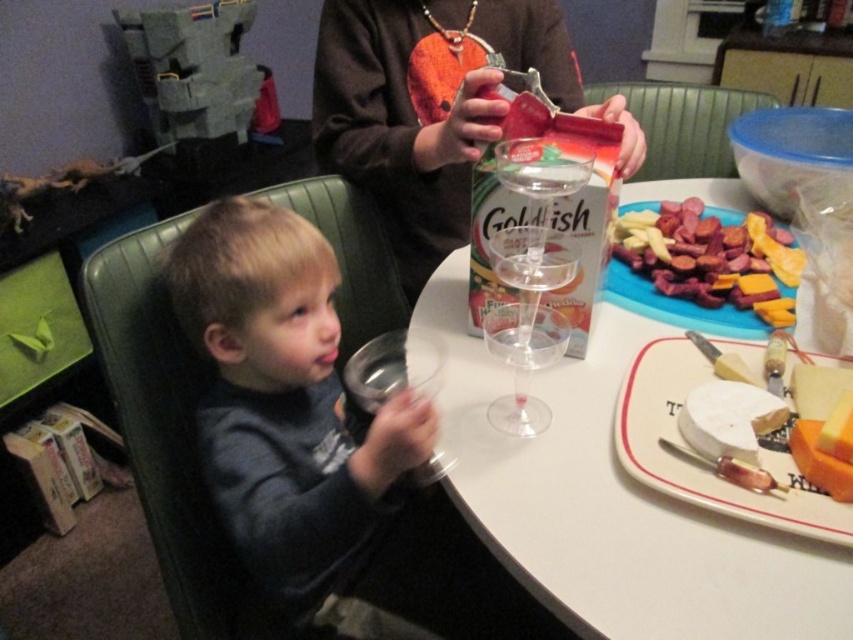
Is white plastic table at center positioned at the back of transparent plastic wine glass at center?

No.

Can you confirm if white plastic table at center is thinner than transparent plastic wine glass at center?

No.

Image resolution: width=853 pixels, height=640 pixels. In order to click on white plastic table at center in this screenshot , I will do `click(611, 502)`.

Does green leather chair at left come in front of white ceramic platter at lower right?

No, it is behind white ceramic platter at lower right.

Is green leather chair at left below white ceramic platter at lower right?

No.

This screenshot has width=853, height=640. Find the location of `green leather chair at left`. green leather chair at left is located at coordinates (161, 429).

You are a GUI agent. You are given a task and a screenshot of the screen. Output one action in this format:
    pyautogui.click(x=<x>, y=<y>)
    Task: Click on the green leather chair at left
    
    Given the screenshot: What is the action you would take?
    click(x=161, y=429)

Between matte brown sweater at upper center and sliced sausage at upper right, which one is positioned higher?

matte brown sweater at upper center is above.

Between matte brown sweater at upper center and sliced sausage at upper right, which one appears on the right side from the viewer's perspective?

sliced sausage at upper right

Identify the location of matte brown sweater at upper center. (434, 106).